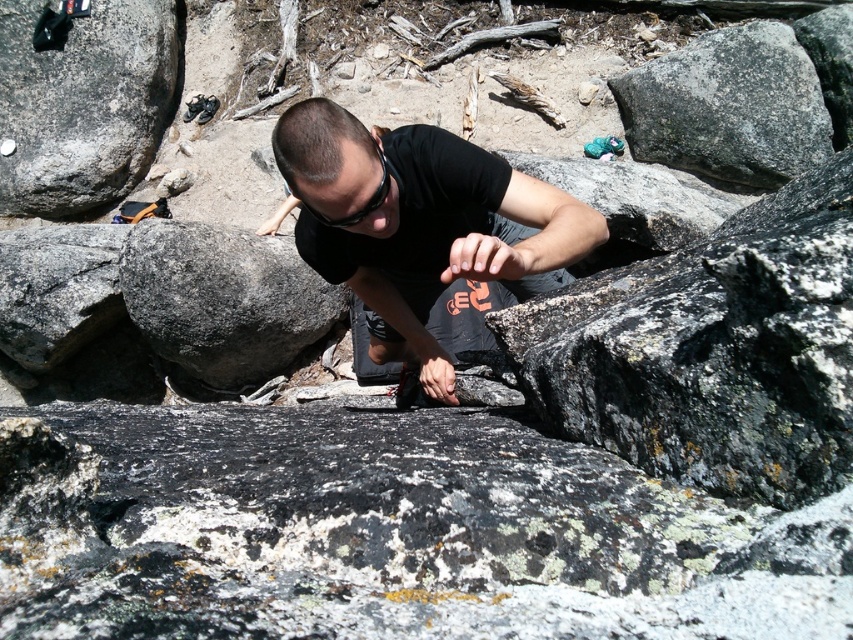
You are a geologist examining the rocky terrain. You notice the smooth gray rock at left and want to collect a sample. Based on its position, can you determine if it is within the first meter of the climbing area?

The smooth gray rock at left is located at point (x=83, y=104), which falls within the first meter of the climbing area, so it is accessible for sampling.